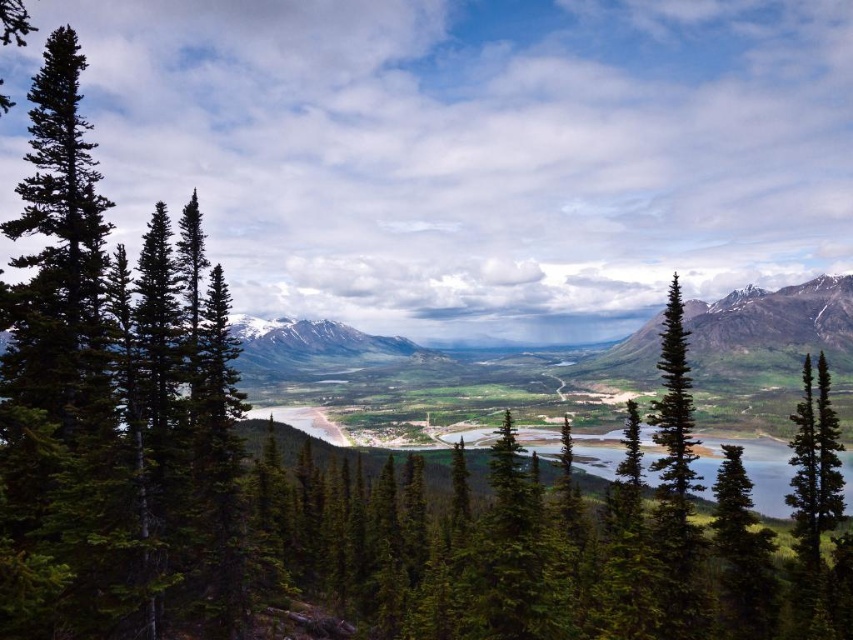
Question: Which of the following is the closest to the observer?

Choices:
 (A) green matte tree at left
 (B) snowy granite mountain at upper right

Answer: (A)

Question: Can you confirm if green matte tree at left is wider than snowy granite mountain at center?

Choices:
 (A) yes
 (B) no

Answer: (B)

Question: In this image, where is snowy granite mountain at upper right located relative to green matte tree at center?

Choices:
 (A) above
 (B) below

Answer: (A)

Question: Does green matte tree at left have a greater width compared to snowy granite mountain at upper right?

Choices:
 (A) yes
 (B) no

Answer: (B)

Question: Which of the following is the closest to the observer?

Choices:
 (A) green matte tree at left
 (B) green matte tree at center
 (C) snowy granite mountain at center

Answer: (A)

Question: Considering the real-world distances, which object is closest to the green matte tree at center?

Choices:
 (A) snowy granite mountain at center
 (B) green matte tree at left
 (C) snowy granite mountain at upper right

Answer: (B)